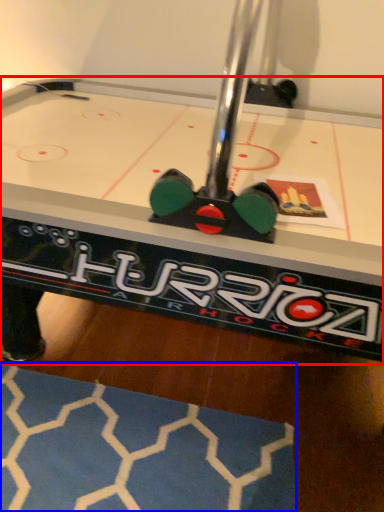
Question: Which object appears farthest to the camera in this image, table (highlighted by a red box) or mat (highlighted by a blue box)?

Choices:
 (A) table
 (B) mat

Answer: (B)